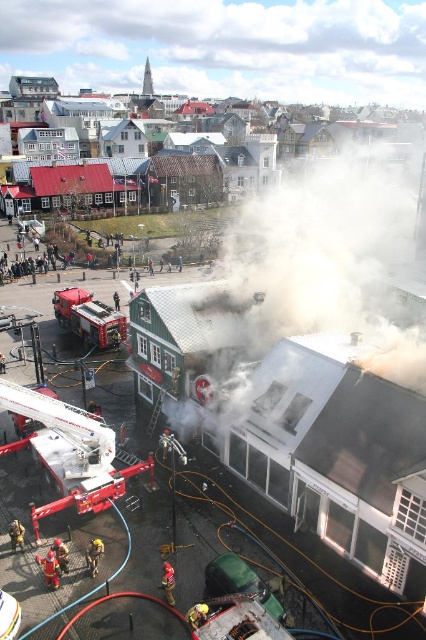
Does black smoke at upper center have a larger size compared to red metallic fire truck at lower left?

Yes, black smoke at upper center is bigger than red metallic fire truck at lower left.

Based on the photo, who is more forward, (368, 209) or (11, 384)?

Point (11, 384) is in front.

The width and height of the screenshot is (426, 640). In order to click on black smoke at upper center in this screenshot , I will do `click(322, 250)`.

Is red metallic fire truck at lower left smaller than metallic red fire truck at center-left?

No, red metallic fire truck at lower left is not smaller than metallic red fire truck at center-left.

Can you confirm if red metallic fire truck at lower left is positioned to the right of metallic red fire truck at center-left?

Yes, red metallic fire truck at lower left is to the right of metallic red fire truck at center-left.

Does point (16, 445) lie in front of point (71, 301)?

Yes, it is.

The width and height of the screenshot is (426, 640). I want to click on red metallic fire truck at lower left, so pyautogui.click(x=69, y=451).

Measure the distance between black smoke at upper center and red uniform fireman at lower left.

The distance of black smoke at upper center from red uniform fireman at lower left is 52.02 meters.

What do you see at coordinates (322, 250) in the screenshot? I see `black smoke at upper center` at bounding box center [322, 250].

Identify the location of black smoke at upper center. The height and width of the screenshot is (640, 426). (322, 250).